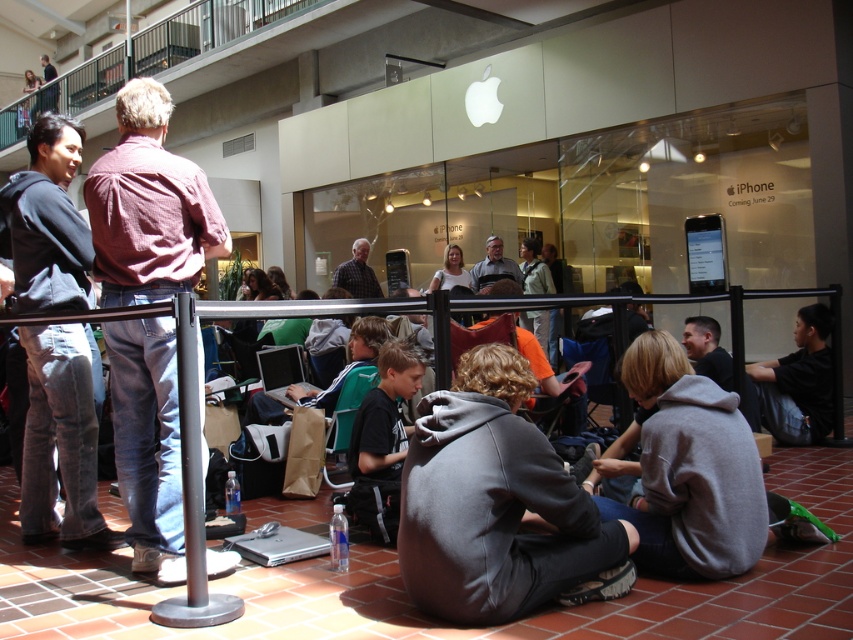
You are a delivery person who needs to place a small package between the gray sweatpants at center and the gray hoodie at lower center. Can you fit the package in the space between them if it requires at least 2 meters of clearance?

The distance between the gray sweatpants at center and the gray hoodie at lower center is 2.63 meters, which is more than the required 2 meters of clearance. Therefore, the package can be placed between them.

Looking at this image, you are planning to sit between the gray sweatpants at center and the gray hoodie at lower center. Which object is wider so you can choose the wider spot to sit?

The gray sweatpants at center is wider than the gray hoodie at lower center, so you should choose the spot near the gray sweatpants at center for more space.